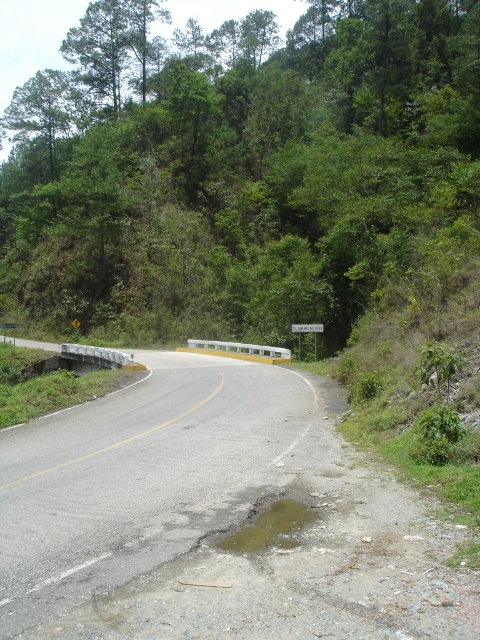
Which of these two, green leafy tree at upper center or asphalt road at center, stands taller?

green leafy tree at upper center

Does point (454, 109) come closer to viewer compared to point (252, 554)?

No, (454, 109) is further to viewer.

Image resolution: width=480 pixels, height=640 pixels. Describe the element at coordinates (241, 170) in the screenshot. I see `green leafy tree at upper center` at that location.

Where is `green leafy tree at upper center`? green leafy tree at upper center is located at coordinates (241, 170).

Does asphalt road at center lie in front of white plastic sign at center?

Yes, asphalt road at center is in front of white plastic sign at center.

Between asphalt road at center and white plastic sign at center, which one has more height?

Standing taller between the two is white plastic sign at center.

Locate an element on the screen. The image size is (480, 640). asphalt road at center is located at coordinates (216, 516).

Consider the image. Between green leafy tree at upper center and white plastic sign at center, which one is positioned higher?

green leafy tree at upper center

The image size is (480, 640). I want to click on green leafy tree at upper center, so click(241, 170).

Image resolution: width=480 pixels, height=640 pixels. I want to click on green leafy tree at upper center, so click(x=241, y=170).